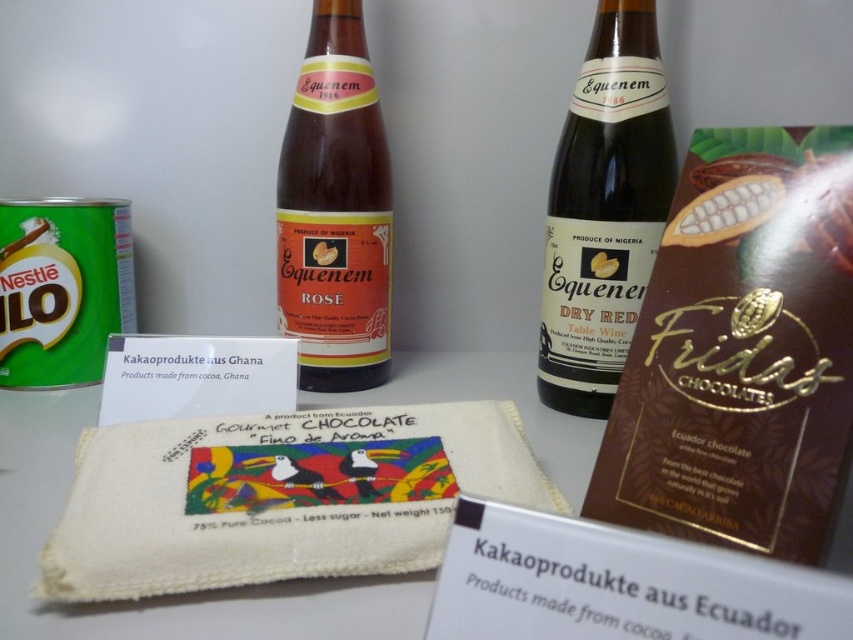
You are organizing a wine display and have two bottles in front of you. The first is the brown glass bottle at center, and the second is the matte glass bottle at center. Which bottle has a smaller diameter?

The brown glass bottle at center is thinner than the matte glass bottle at center, so the brown glass bottle at center has a smaller diameter.